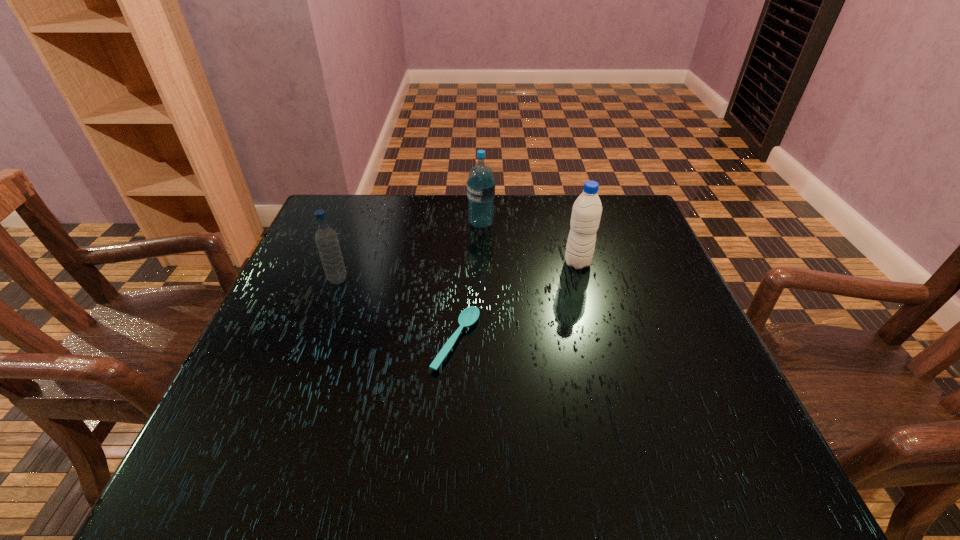
Locate an element on the screen. This screenshot has height=540, width=960. the third nearest object is located at coordinates (586, 213).

The width and height of the screenshot is (960, 540). I want to click on the second nearest water bottle, so click(x=586, y=213).

Identify the location of the second water bottle from left to right. (481, 185).

Image resolution: width=960 pixels, height=540 pixels. I want to click on the farthest object, so click(481, 185).

The height and width of the screenshot is (540, 960). I want to click on the second nearest object, so click(326, 238).

The image size is (960, 540). I want to click on the leftmost water bottle, so click(326, 238).

Locate an element on the screen. This screenshot has height=540, width=960. spoon is located at coordinates (468, 316).

This screenshot has width=960, height=540. I want to click on the nearest object, so click(x=468, y=316).

This screenshot has height=540, width=960. What are the coordinates of `vacant area situated on the front of the rightmost water bottle` in the screenshot? It's located at (610, 386).

You are a GUI agent. You are given a task and a screenshot of the screen. Output one action in this format:
    pyautogui.click(x=<x>, y=<y>)
    Task: Click on the free region located 0.080m on the right of the second water bottle from right to left
    
    Given the screenshot: What is the action you would take?
    (x=524, y=224)